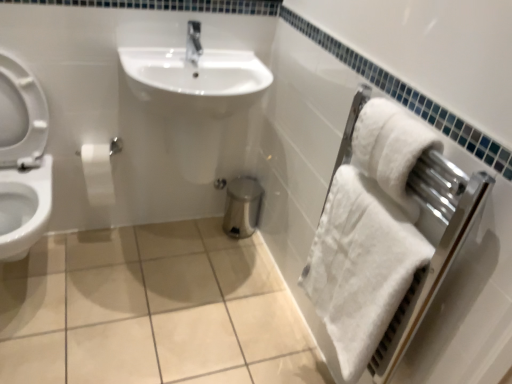
Find the location of a particular element. This screenshot has width=512, height=384. free space above beige ceramic tile at center (from a real-world perspective) is located at coordinates (x=141, y=313).